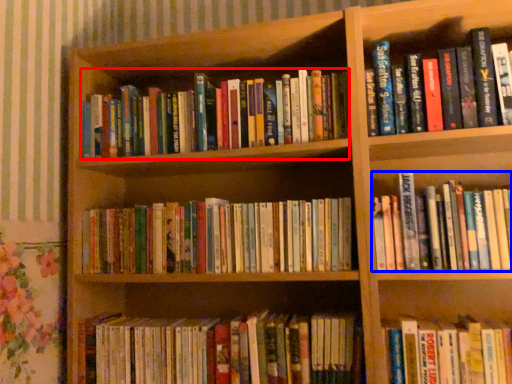
Question: Which object is further to the camera taking this photo, book (highlighted by a red box) or book (highlighted by a blue box)?

Choices:
 (A) book
 (B) book

Answer: (A)